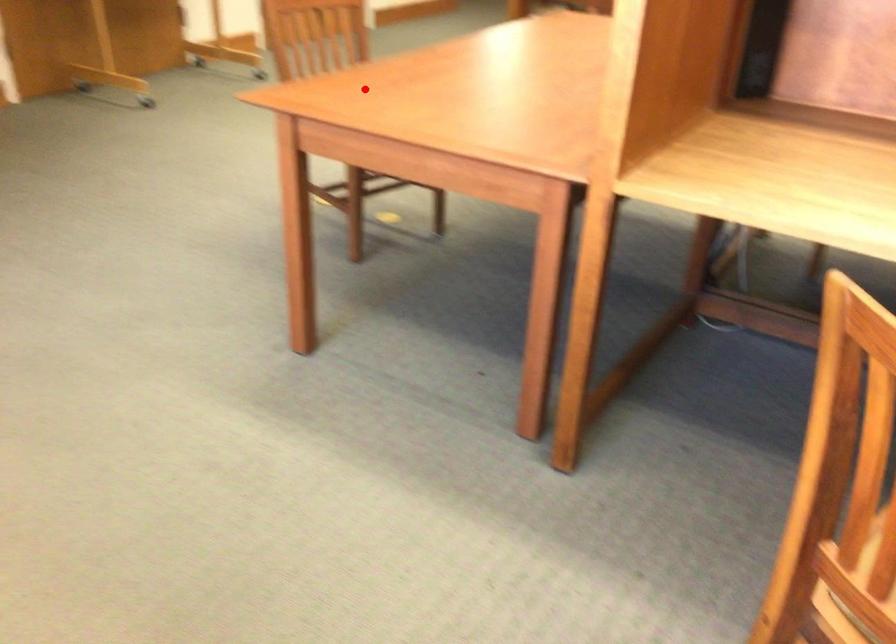
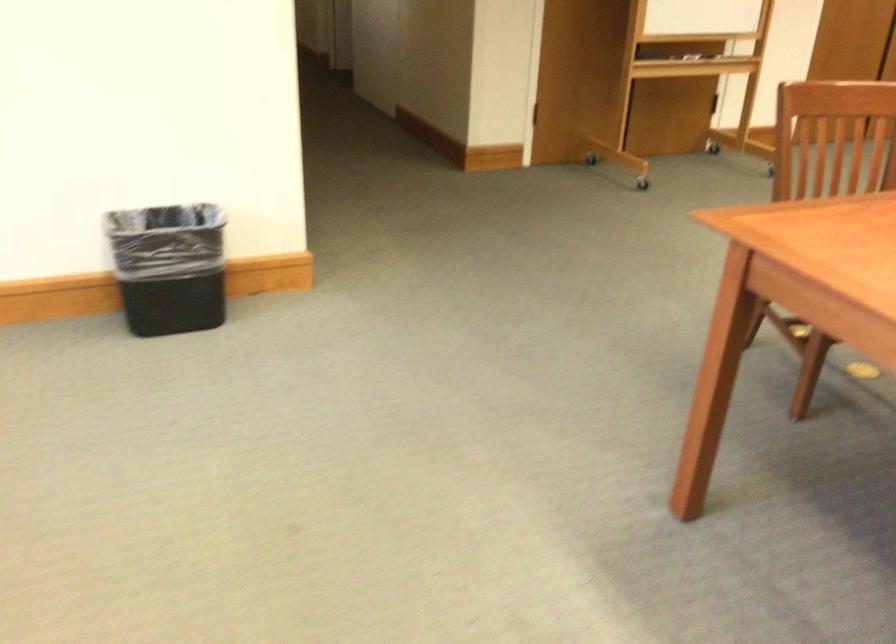
In the second image, find the point that corresponds to the highlighted location in the first image.

(849, 220)